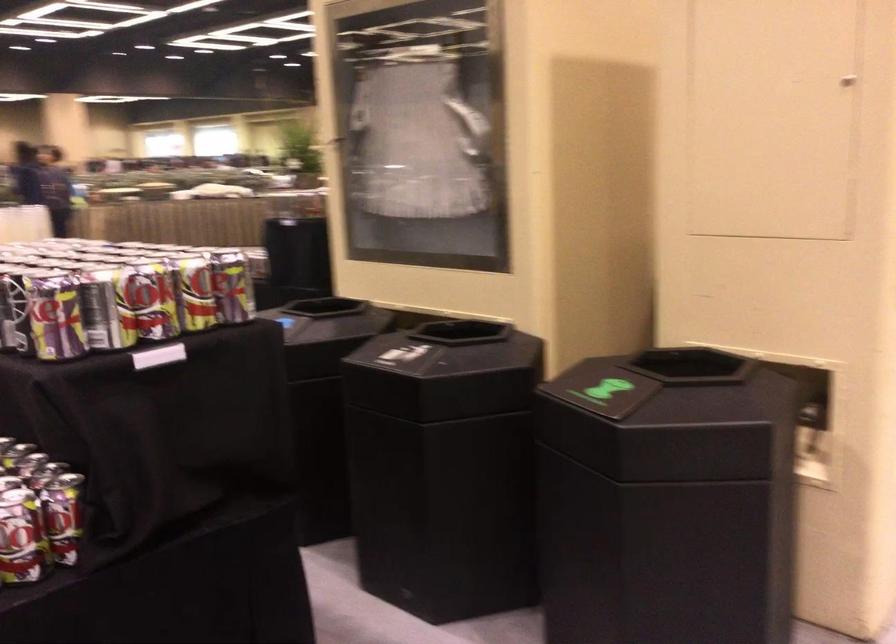
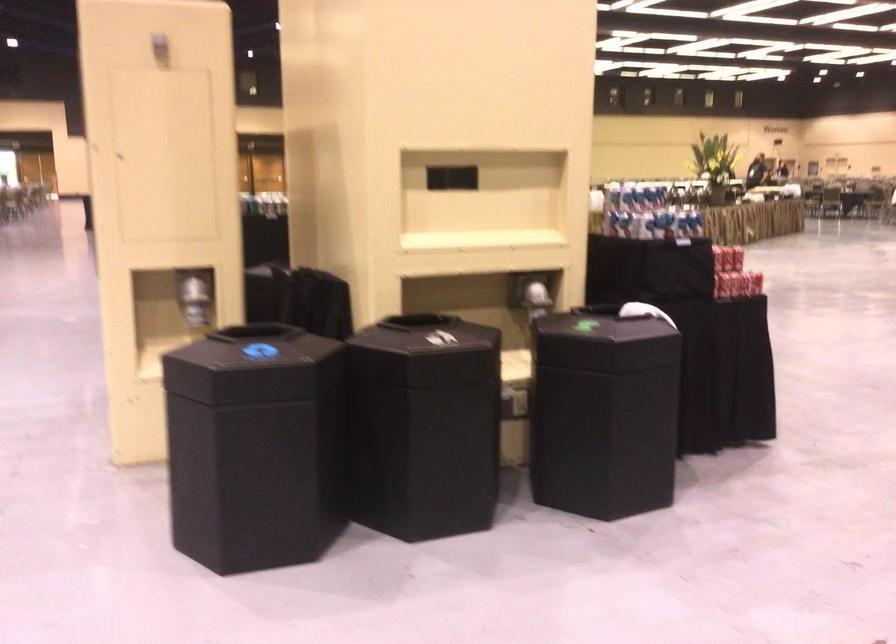
Question: I am providing you with two images of the same scene from different viewpoints. Which of the following objects are not visible in image2?

Choices:
 (A) beverage can
 (B) white washer lid
 (C) black bin lid
 (D) shiny dispenser lever

Answer: (A)